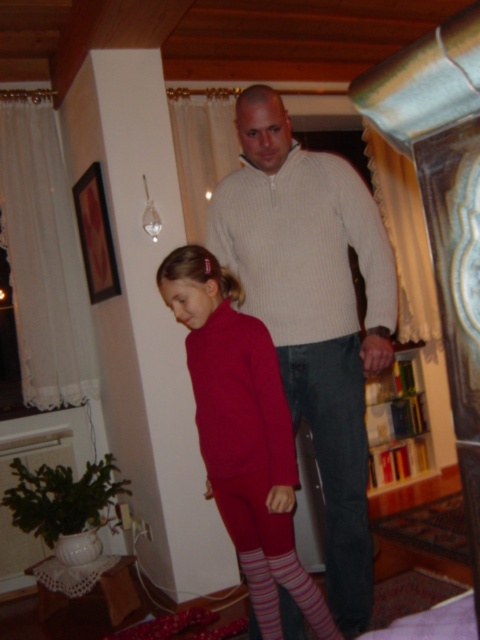
You are a photographer trying to capture a candid shot of the matte red sweater at center. You are standing at the point marked by coordinates point (242, 433). Where should you position yourself to frame the shot properly?

The point (242, 433) marks the location of the matte red sweater at center, so you should position yourself directly in front of this point to frame the shot properly.

You are a fashion designer observing the scene and notice the pink striped sock at lower center and the striped cotton sock at lower center. Which sock has a greater height?

The pink striped sock at lower center is taller than the striped cotton sock at lower center.

Based on the photo, please provide the 2D coordinates of the knitted beige sweater at center in the image.

The knitted beige sweater at center is located at the coordinates point (313,312).